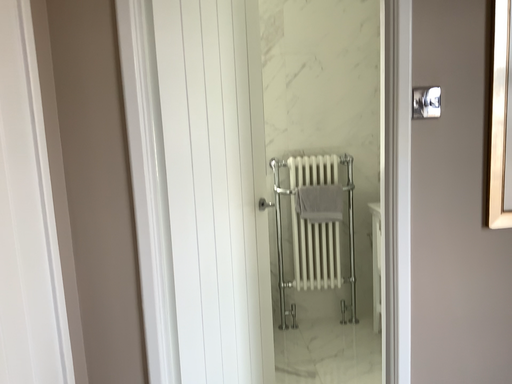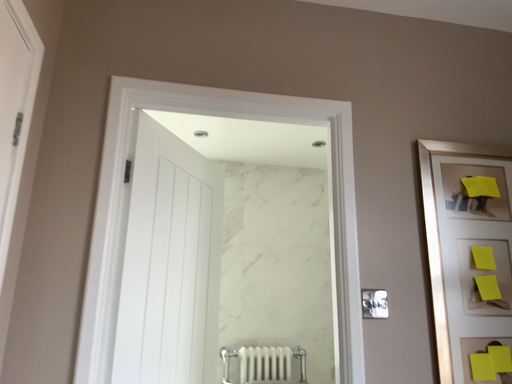
Question: Which way did the camera rotate in the video?

Choices:
 (A) rotated upward
 (B) rotated downward

Answer: (A)